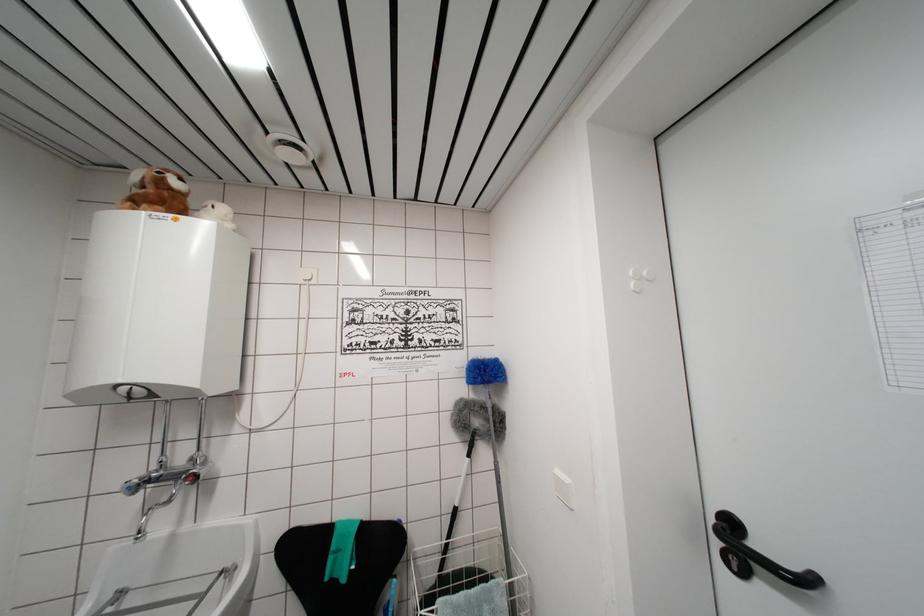
Where would you pushing down the black door handle? Please return your answer as a coordinate pair (x, y).

(755, 554)